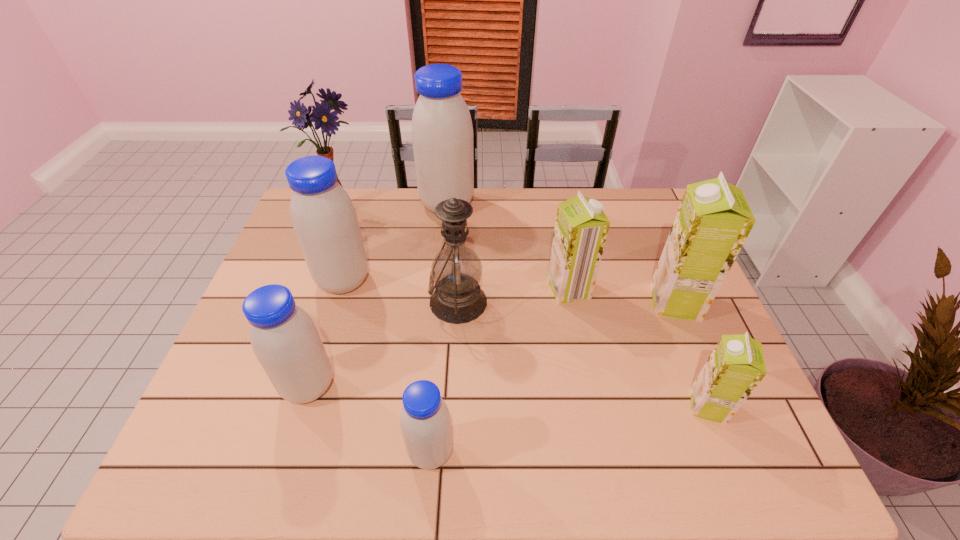
The height and width of the screenshot is (540, 960). In order to click on free space located 0.300m on the back of the nearest object in this screenshot , I will do `click(442, 322)`.

What are the coordinates of `soya milk that is at the far edge` in the screenshot? It's located at (442, 133).

Identify the location of flower arrangement situated at the far edge. (321, 115).

Identify the location of object that is at the near edge. This screenshot has height=540, width=960. (425, 422).

Find the location of a particular element. flower arrangement that is positioned at the left edge is located at coordinates (321, 115).

The height and width of the screenshot is (540, 960). I want to click on object situated at the far left corner, so click(x=321, y=115).

This screenshot has width=960, height=540. In the image, there is a desktop. In order to click on vacant space at the far edge in this screenshot , I will do `click(371, 198)`.

Locate an element on the screen. The width and height of the screenshot is (960, 540). free space at the near edge of the desktop is located at coordinates (383, 440).

In order to click on free space at the left edge in this screenshot , I will do `click(246, 420)`.

This screenshot has height=540, width=960. I want to click on vacant space at the far right corner of the desktop, so click(640, 207).